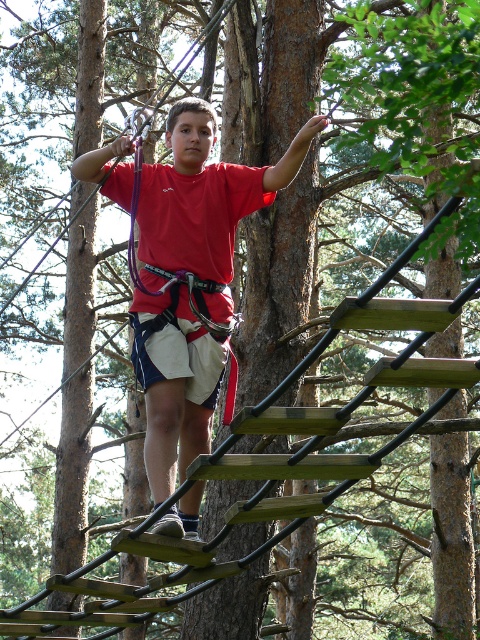
Is red matte shirt at center positioned before white cotton shorts at center?

Yes, red matte shirt at center is closer to the viewer.

Measure the distance from red matte shirt at center to white cotton shorts at center.

15.27 inches

The image size is (480, 640). Find the location of `red matte shirt at center`. red matte shirt at center is located at coordinates (205, 195).